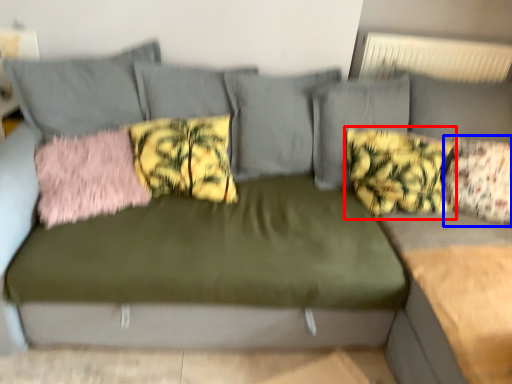
Question: Which of the following is the closest to the observer, pillow (highlighted by a red box) or pillow (highlighted by a blue box)?

Choices:
 (A) pillow
 (B) pillow

Answer: (B)